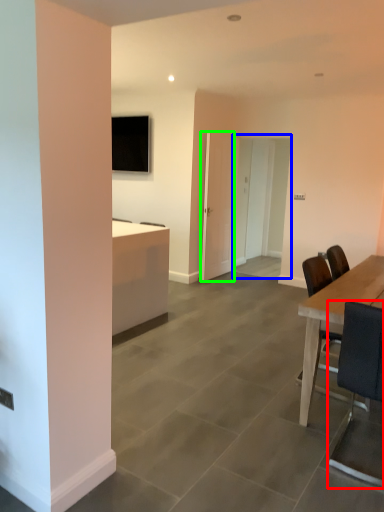
Question: Which object is positioned closest to chair (highlighted by a red box)? Select from glass door (highlighted by a blue box) and glass door (highlighted by a green box).

Choices:
 (A) glass door
 (B) glass door

Answer: (B)